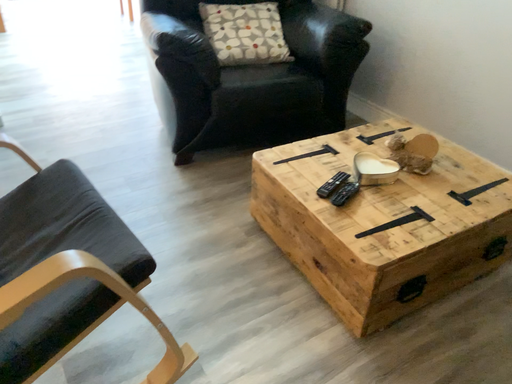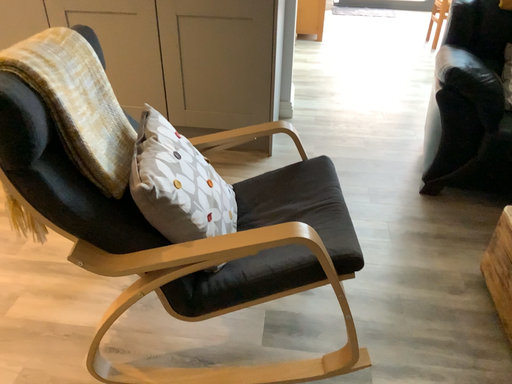
Question: Which way did the camera rotate in the video?

Choices:
 (A) rotated upward
 (B) rotated downward

Answer: (A)